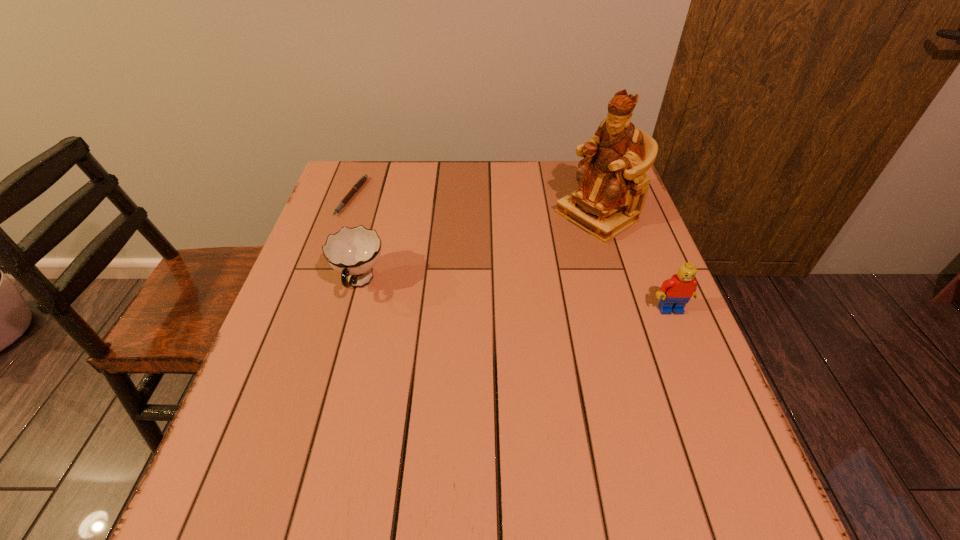
This screenshot has height=540, width=960. Identify the location of vacant region located at the nib of the shortest object. (365, 222).

Locate an element on the screen. vacant region located at the nib of the shortest object is located at coordinates (376, 232).

What are the coordinates of `figurine located in the far edge section of the desktop` in the screenshot? It's located at click(x=612, y=185).

At what (x,y) coordinates should I click in order to perform the action: click on pen that is at the far edge. Please return your answer as a coordinate pair (x, y). This screenshot has width=960, height=540. Looking at the image, I should click on (360, 182).

Image resolution: width=960 pixels, height=540 pixels. What are the coordinates of `cup positioned at the left edge` in the screenshot? It's located at (352, 252).

At what (x,y) coordinates should I click in order to perform the action: click on pen present at the left edge. Please return your answer as a coordinate pair (x, y). Looking at the image, I should click on (360, 182).

What are the coordinates of `Lego located at the right edge` in the screenshot? It's located at (675, 292).

Identify the location of figurine situated at the right edge. (612, 185).

You are a GUI agent. You are given a task and a screenshot of the screen. Output one action in this format:
    pyautogui.click(x=<x>, y=<y>)
    Task: Click on the object that is positioned at the far left corner
    Image resolution: width=960 pixels, height=540 pixels.
    Given the screenshot: What is the action you would take?
    pyautogui.click(x=360, y=182)

The width and height of the screenshot is (960, 540). I want to click on object located in the far right corner section of the desktop, so click(x=612, y=185).